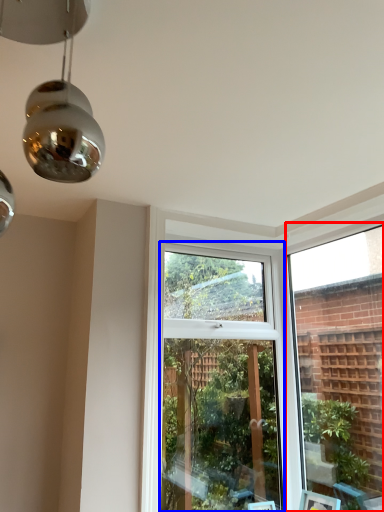
Question: Which object appears farthest to the camera in this image, window frame (highlighted by a red box) or window (highlighted by a blue box)?

Choices:
 (A) window frame
 (B) window

Answer: (B)